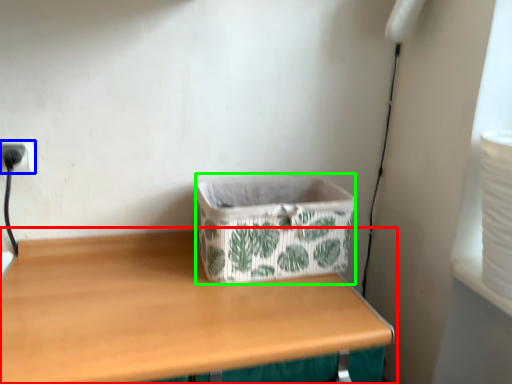
Question: Based on their relative distances, which object is nearer to table (highlighted by a red box)? Choose from electric outlet (highlighted by a blue box) and storage box (highlighted by a green box).

Choices:
 (A) electric outlet
 (B) storage box

Answer: (B)